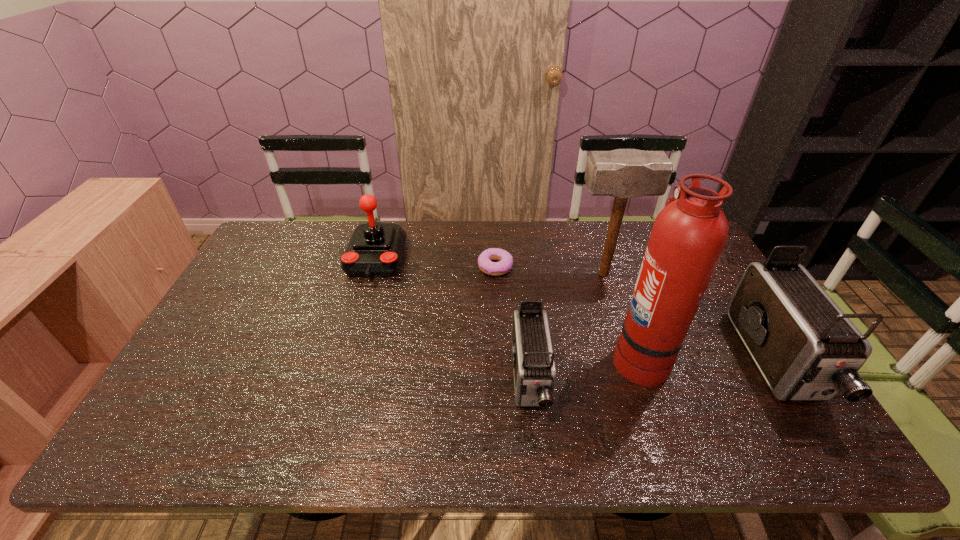
Identify the location of object situated at the right edge. The height and width of the screenshot is (540, 960). (807, 349).

Where is `object located at the near right corner`? object located at the near right corner is located at coordinates click(x=807, y=349).

You are a GUI agent. You are given a task and a screenshot of the screen. Output one action in this format:
    pyautogui.click(x=<x>, y=<y>)
    Task: Click on the vacant space at the far edge
    The width and height of the screenshot is (960, 540).
    Given the screenshot: What is the action you would take?
    pyautogui.click(x=324, y=235)

The height and width of the screenshot is (540, 960). I want to click on vacant point at the near edge, so click(x=229, y=406).

This screenshot has height=540, width=960. Find the location of `blank space at the left edge`. blank space at the left edge is located at coordinates (256, 265).

You are a GUI agent. You are given a task and a screenshot of the screen. Output one action in this format:
    pyautogui.click(x=<x>, y=<y>)
    Task: Click on the vacant space at the right edge
    The width and height of the screenshot is (960, 540).
    Given the screenshot: What is the action you would take?
    pyautogui.click(x=749, y=359)

The image size is (960, 540). What are the coordinates of `vacant space at the far left corner` in the screenshot? It's located at click(259, 246).

Where is `unoccupied area between the shortest object and the joystick`? unoccupied area between the shortest object and the joystick is located at coordinates (436, 262).

Image resolution: width=960 pixels, height=540 pixels. In order to click on free point between the doughnut and the left camcorder in this screenshot , I will do `click(513, 323)`.

Find the location of a particular element. The height and width of the screenshot is (540, 960). vacant region between the right camcorder and the leftmost object is located at coordinates (576, 310).